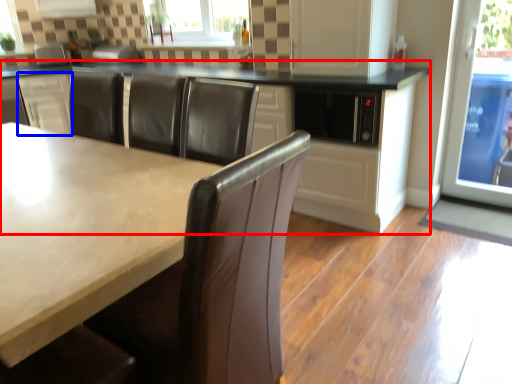
Question: Among these objects, which one is farthest to the camera, cabinetry (highlighted by a red box) or cabinetry (highlighted by a blue box)?

Choices:
 (A) cabinetry
 (B) cabinetry

Answer: (B)